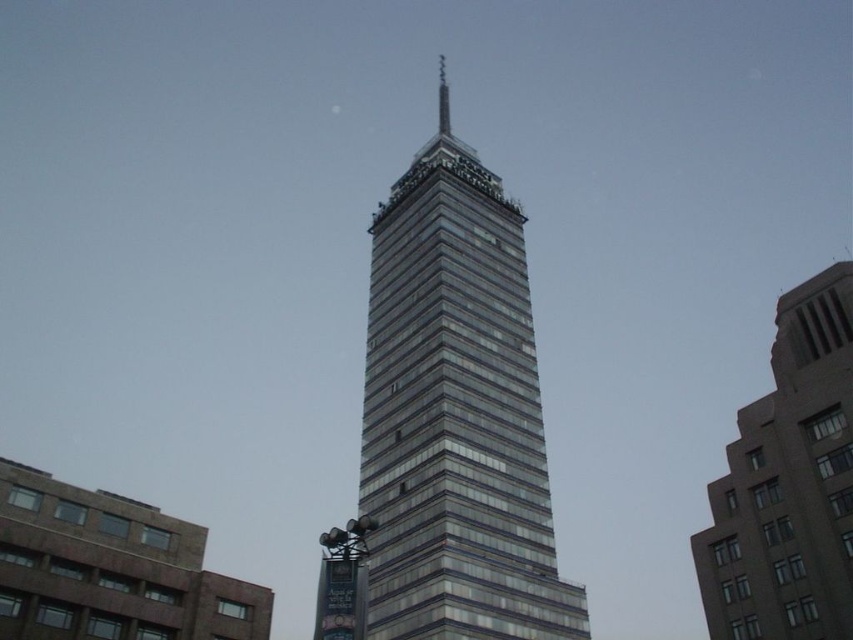
Does glassy steel tower at center appear over gray concrete building at right?

Yes.

Is glassy steel tower at center to the left of gray concrete building at right from the viewer's perspective?

Indeed, glassy steel tower at center is positioned on the left side of gray concrete building at right.

The width and height of the screenshot is (853, 640). In order to click on glassy steel tower at center in this screenshot , I will do `click(456, 413)`.

Locate an element on the screen. glassy steel tower at center is located at coordinates (456, 413).